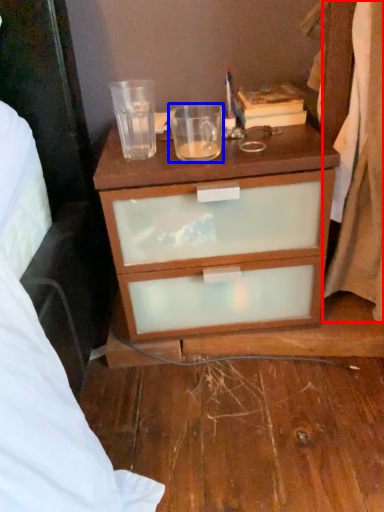
Question: Among these objects, which one is farthest to the camera, curtain (highlighted by a red box) or coffee cup (highlighted by a blue box)?

Choices:
 (A) curtain
 (B) coffee cup

Answer: (B)